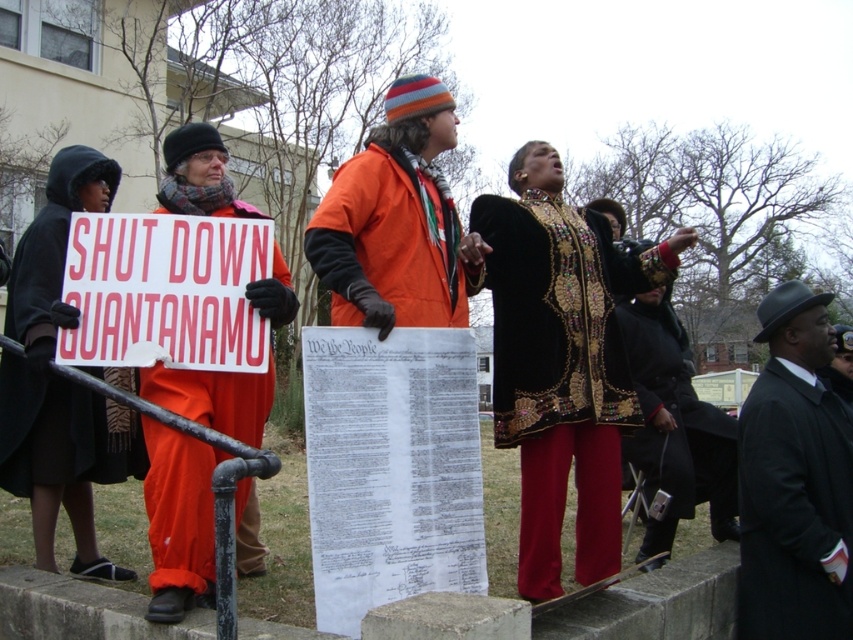
What do you see at coordinates (793, 480) in the screenshot? This screenshot has width=853, height=640. I see `black wool hat at upper right` at bounding box center [793, 480].

Does black wool hat at upper right appear on the right side of white paper sign at left?

Correct, you'll find black wool hat at upper right to the right of white paper sign at left.

Identify the location of black wool hat at upper right. The height and width of the screenshot is (640, 853). (793, 480).

Which of these two, black wool hat at upper right or black velvet coat at center, stands taller?

With more height is black wool hat at upper right.

Can you confirm if black wool hat at upper right is wider than black velvet coat at center?

Incorrect, black wool hat at upper right's width does not surpass black velvet coat at center's.

Describe the element at coordinates (793, 480) in the screenshot. I see `black wool hat at upper right` at that location.

Find the location of a particular element. black wool hat at upper right is located at coordinates click(x=793, y=480).

Is white paper sign at left bigger than black matte robe at left?

No.

Can you confirm if white paper sign at left is taller than black matte robe at left?

Incorrect, white paper sign at left's height is not larger of black matte robe at left's.

Is point (172, 368) positioned in front of point (68, 221)?

Yes, point (172, 368) is closer to viewer.

Image resolution: width=853 pixels, height=640 pixels. Identify the location of white paper sign at left. (165, 291).